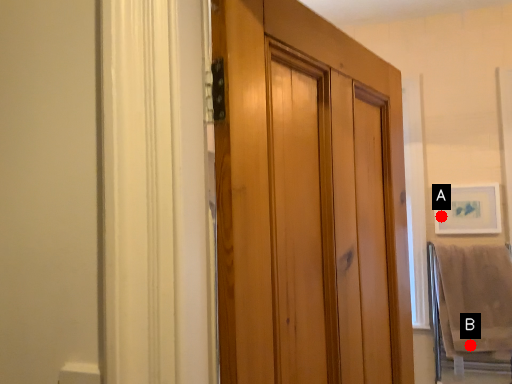
Question: Two points are circled on the image, labeled by A and B beside each circle. Among these points, which one is nearest to the camera?

Choices:
 (A) A is closer
 (B) B is closer

Answer: (B)